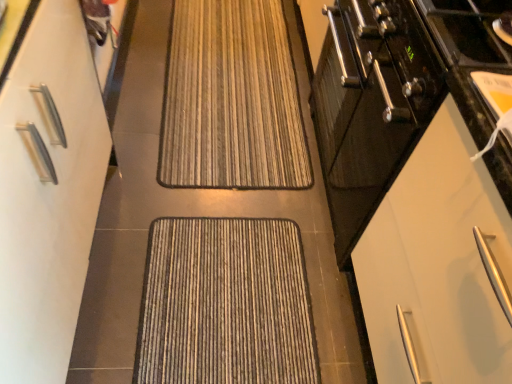
Question: Is white matte cabinet at left, marked as the 2th cabinetry in a right-to-left arrangement, wider than textured brown doormat at center, acting as the 2th doormat starting from the back?

Choices:
 (A) yes
 (B) no

Answer: (B)

Question: Is white matte cabinet at left, arranged as the 1th cabinetry when viewed from the left, outside textured brown doormat at center, which is the first doormat from front to back?

Choices:
 (A) no
 (B) yes

Answer: (B)

Question: From the image's perspective, is white matte cabinet at left, marked as the 2th cabinetry in a right-to-left arrangement, on textured brown doormat at center, acting as the 2th doormat starting from the back?

Choices:
 (A) no
 (B) yes

Answer: (B)

Question: Is white matte cabinet at left, marked as the 2th cabinetry in a right-to-left arrangement, closer to the viewer compared to textured brown doormat at center, acting as the 2th doormat starting from the back?

Choices:
 (A) no
 (B) yes

Answer: (B)

Question: Is white matte cabinet at left, marked as the 2th cabinetry in a right-to-left arrangement, surrounding textured brown doormat at center, which is the first doormat from front to back?

Choices:
 (A) no
 (B) yes

Answer: (A)

Question: Is white matte cabinet at left, marked as the 2th cabinetry in a right-to-left arrangement, inside or outside of brown striped mat at center, which appears as the first doormat when viewed from the back?

Choices:
 (A) inside
 (B) outside

Answer: (B)

Question: Is white matte cabinet at left, marked as the 2th cabinetry in a right-to-left arrangement, taller or shorter than brown striped mat at center, arranged as the 1th doormat when viewed from the top?

Choices:
 (A) tall
 (B) short

Answer: (A)

Question: Relative to brown striped mat at center, which appears as the first doormat when viewed from the back, is white matte cabinet at left, arranged as the 1th cabinetry when viewed from the left, in front or behind?

Choices:
 (A) behind
 (B) front

Answer: (B)

Question: Is white matte cabinet at left, marked as the 2th cabinetry in a right-to-left arrangement, to the left or to the right of brown striped mat at center, which appears as the first doormat when viewed from the back, in the image?

Choices:
 (A) left
 (B) right

Answer: (A)

Question: In the image, is white matte cabinet at right, the 1th cabinetry from the right, on the left side or the right side of white matte cabinet at left, arranged as the 1th cabinetry when viewed from the left?

Choices:
 (A) left
 (B) right

Answer: (B)

Question: In terms of height, does white matte cabinet at right, the 1th cabinetry from the right, look taller or shorter compared to white matte cabinet at left, arranged as the 1th cabinetry when viewed from the left?

Choices:
 (A) tall
 (B) short

Answer: (B)

Question: Which is correct: white matte cabinet at right, the 1th cabinetry from the right, is inside white matte cabinet at left, arranged as the 1th cabinetry when viewed from the left, or outside of it?

Choices:
 (A) inside
 (B) outside

Answer: (B)

Question: Does point (455, 104) appear closer or farther from the camera than point (27, 243)?

Choices:
 (A) farther
 (B) closer

Answer: (B)

Question: Considering their positions, is brown striped mat at center, arranged as the 1th doormat when viewed from the top, located in front of or behind textured brown doormat at center, which is the first doormat from front to back?

Choices:
 (A) front
 (B) behind

Answer: (B)

Question: From a real-world perspective, relative to textured brown doormat at center, the second doormat positioned from the top, is brown striped mat at center, the second doormat positioned from the front, vertically above or below?

Choices:
 (A) above
 (B) below

Answer: (A)